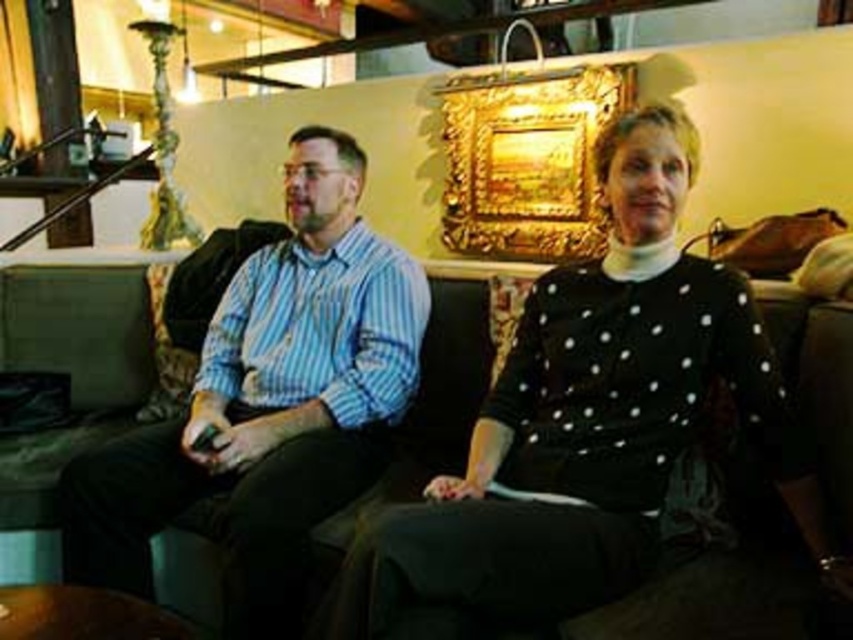
Question: Is black dotted sweater at center to the right of black leather couch at center from the viewer's perspective?

Choices:
 (A) yes
 (B) no

Answer: (A)

Question: Considering the real-world distances, which object is farthest from the blue striped shirt at left?

Choices:
 (A) black dotted sweater at center
 (B) black leather couch at center

Answer: (B)

Question: Is black dotted sweater at center smaller than blue striped shirt at left?

Choices:
 (A) yes
 (B) no

Answer: (A)

Question: Which object is positioned closest to the blue striped shirt at left?

Choices:
 (A) black leather couch at center
 (B) black dotted sweater at center

Answer: (B)

Question: Which of the following is the closest to the observer?

Choices:
 (A) (662, 362)
 (B) (314, 465)
 (C) (320, 556)

Answer: (A)

Question: Can you confirm if black dotted sweater at center is positioned below blue striped shirt at left?

Choices:
 (A) yes
 (B) no

Answer: (A)